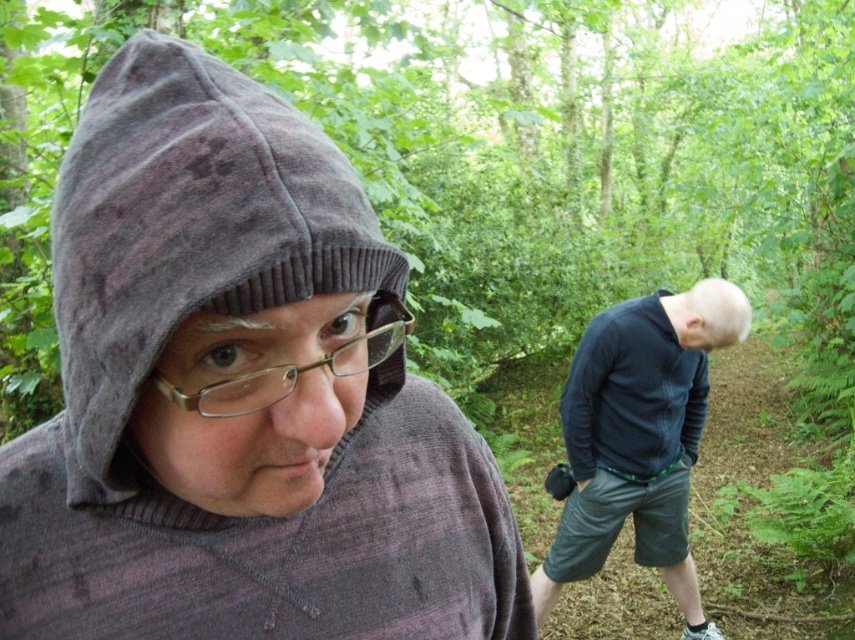
You are a photographer trying to capture a clear shot of both the dark blue sweater at center and the metallic gold glasses at center. Which object should you focus on first to ensure both are in focus?

You should focus on the dark blue sweater at center first because it is closer to you than the metallic gold glasses at center, ensuring both will be in focus when using a camera with a fixed focal point.

You are a photographer trying to capture the scene. The velvety gray hood at left and the metallic gold glasses at center are in your frame. Based on their positions, which object would appear larger in your photo?

The velvety gray hood at left is taller than the metallic gold glasses at center, so it would appear larger in the photo.